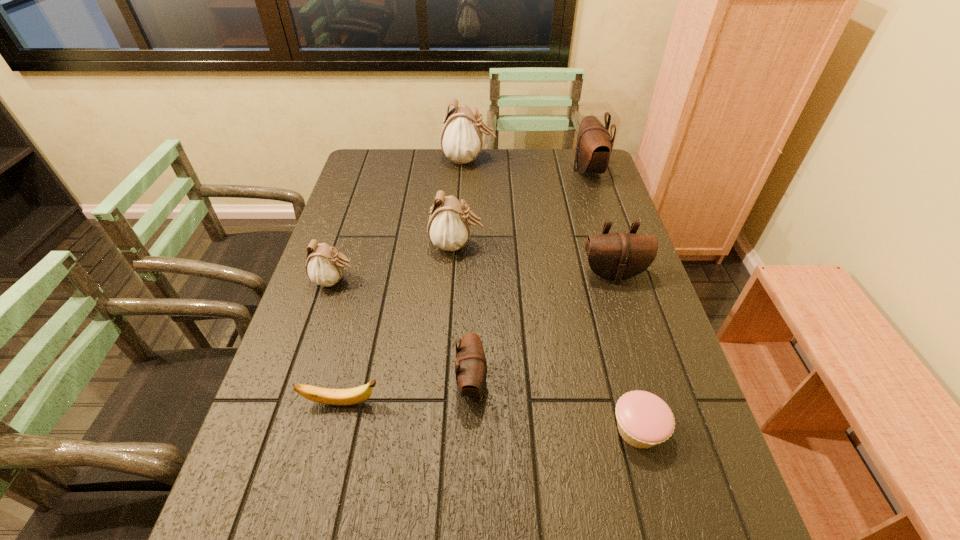
Identify the location of the biggest white pouch. (461, 139).

Identify the location of the farthest brown pouch. The width and height of the screenshot is (960, 540). (594, 145).

Where is `the sixth nearest object`? This screenshot has height=540, width=960. the sixth nearest object is located at coordinates (448, 228).

At what (x,y) coordinates should I click in order to perform the action: click on the second smallest white pouch. Please return your answer as a coordinate pair (x, y). Looking at the image, I should click on (448, 228).

The width and height of the screenshot is (960, 540). Find the location of `the second smallest brown pouch`. the second smallest brown pouch is located at coordinates (618, 256).

Where is `the leftmost white pouch`? the leftmost white pouch is located at coordinates (324, 266).

Locate an element on the screen. The height and width of the screenshot is (540, 960). the smallest white pouch is located at coordinates click(324, 266).

You are a GUI agent. You are given a task and a screenshot of the screen. Output one action in this format:
    pyautogui.click(x=<x>, y=<y>)
    Task: Click on the nearest brown pouch
    This screenshot has height=540, width=960.
    Given the screenshot: What is the action you would take?
    pyautogui.click(x=471, y=368)

Locate an element on the screen. The width and height of the screenshot is (960, 540). the leftmost brown pouch is located at coordinates (471, 368).

Where is `the seventh tallest object`? This screenshot has height=540, width=960. the seventh tallest object is located at coordinates (351, 396).